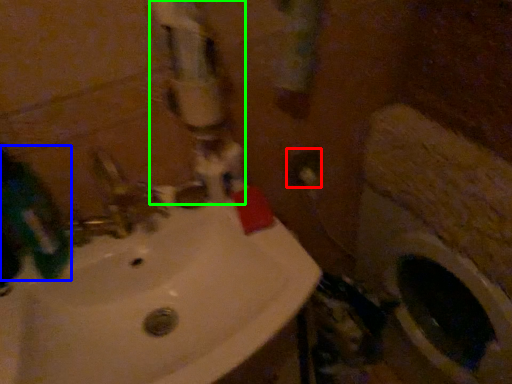
Question: Which object is positioned farthest from electric outlet (highlighted by a red box)? Select from mouthwash (highlighted by a blue box) and water pipe (highlighted by a green box).

Choices:
 (A) mouthwash
 (B) water pipe

Answer: (A)